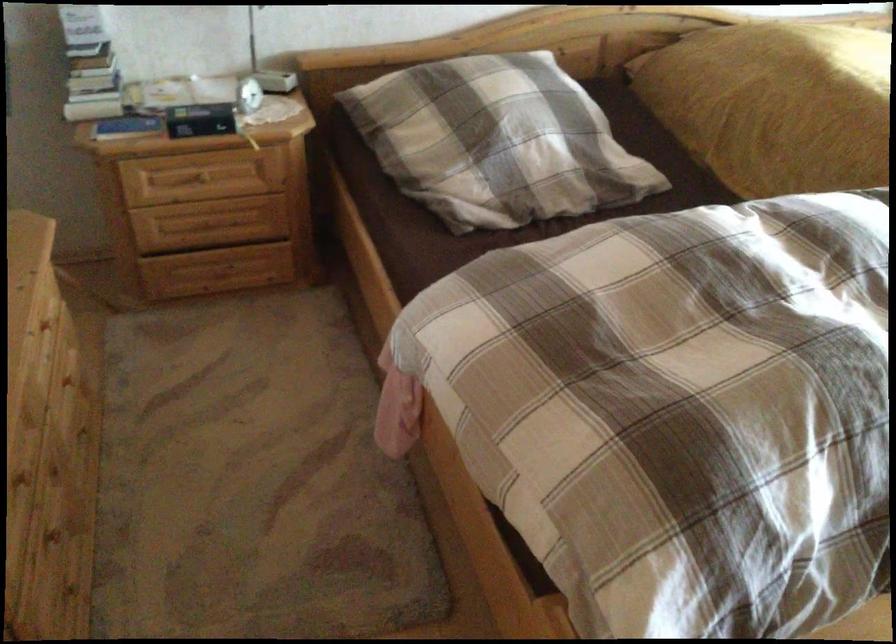
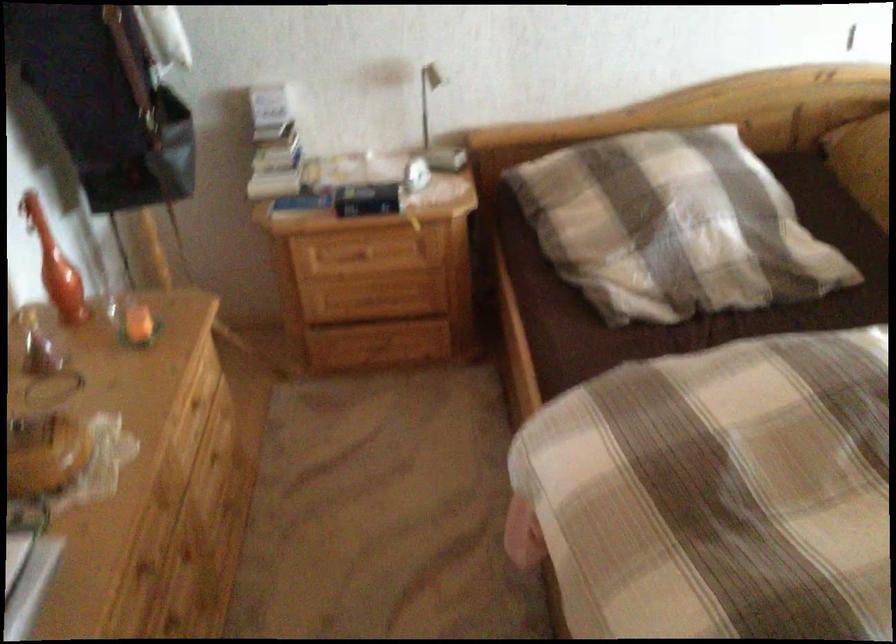
Where in the second image is the point corresponding to the point at 208,182 from the first image?

(366, 252)